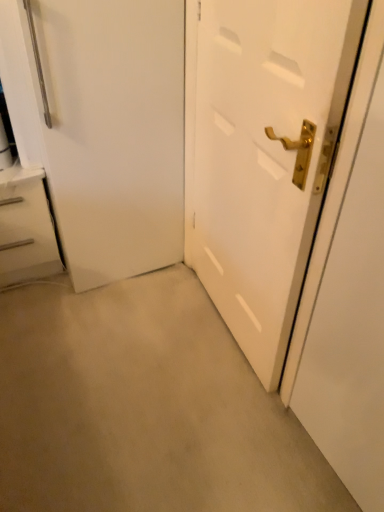
Question: Is white glossy chest of drawers at left to the left or to the right of white glossy door handle at right in the image?

Choices:
 (A) right
 (B) left

Answer: (B)

Question: From the image's perspective, is white glossy chest of drawers at left located above or below white glossy door handle at right?

Choices:
 (A) below
 (B) above

Answer: (B)

Question: Which is farther from the white glossy door handle at right?

Choices:
 (A) white matte door at center
 (B) white glossy chest of drawers at left

Answer: (B)

Question: Which object is the closest to the white matte door at center?

Choices:
 (A) white glossy door handle at right
 (B) white glossy chest of drawers at left

Answer: (A)